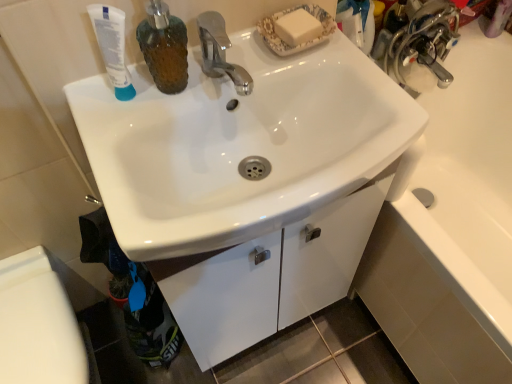
The width and height of the screenshot is (512, 384). Identify the location of empty space that is ontop of white glossy toilet bowl at lower left. (29, 336).